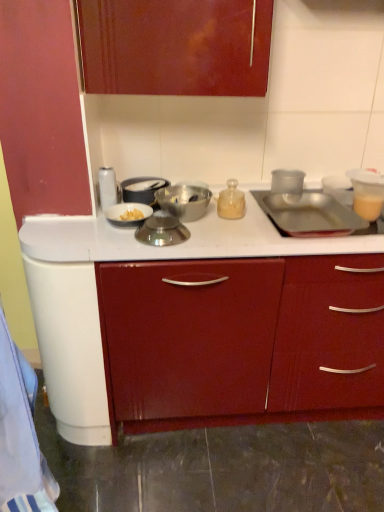
Find the location of a particular element. vacant space positioned to the left of shiny metallic bowl at center, which is the 4th kitchen appliance from left to right is located at coordinates (114, 242).